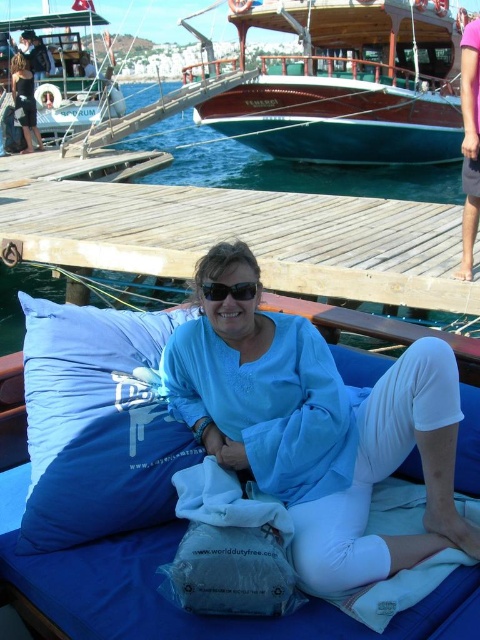
Based on the photo, you are a photographer standing at the edge of the dock. You want to take a photo of the blue cotton shirt at center. Where should you position yourself to capture it in the frame?

The blue cotton shirt at center is located at point 0.669 on the x axis and 0.660 on the y axis, so you should position yourself facing towards the center of the scene to capture it in the frame.

You are a photographer trying to capture a photo of the wooden boat at upper left without including the blue fabric pillow at center in the frame. Is this possible based on their positions?

The blue fabric pillow at center is positioned on the right side of the wooden boat at upper left, so if you move to the left side of the boat, you can capture the boat without the pillow in the frame.

You are a photographer trying to capture a photo of the wooden boat at upper left without including the blue cotton shirt at center in the frame. Is this possible given their sizes?

The blue cotton shirt at center has a lesser width compared to the wooden boat at upper left, so it is possible to capture the wooden boat at upper left without including the blue cotton shirt at center in the frame by adjusting the camera angle or zoom to exclude the smaller shirt.